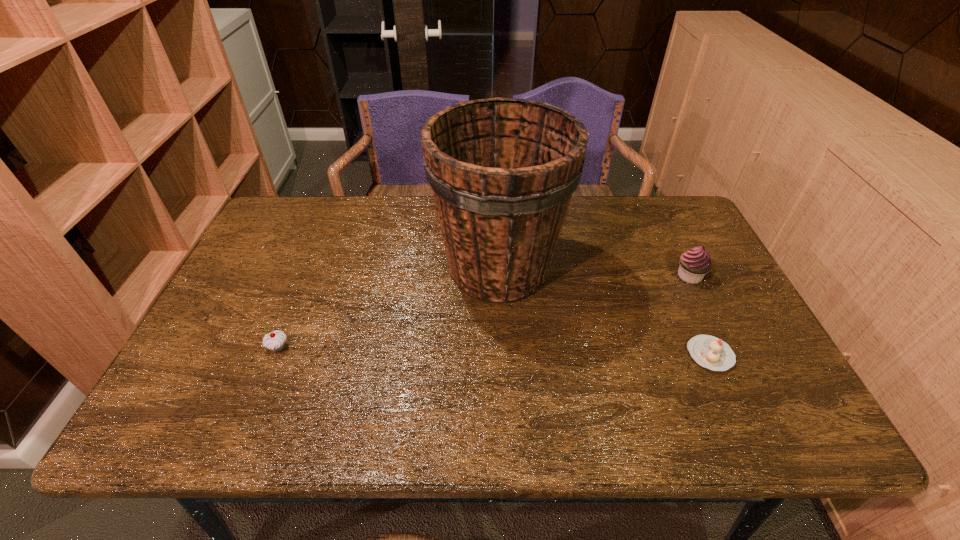
Identify the location of the closest cupcake to the shortest object. The height and width of the screenshot is (540, 960). (695, 263).

Identify the location of free space that satisfies the following two spatial constraints: 1. on the back side of the second object from left to right; 2. on the right side of the leftmost cupcake. This screenshot has width=960, height=540. (311, 268).

At what (x,y) coordinates should I click in order to perform the action: click on free location that satisfies the following two spatial constraints: 1. on the front side of the bucket; 2. on the right side of the farthest cupcake. Please return your answer as a coordinate pair (x, y). The height and width of the screenshot is (540, 960). Looking at the image, I should click on (499, 276).